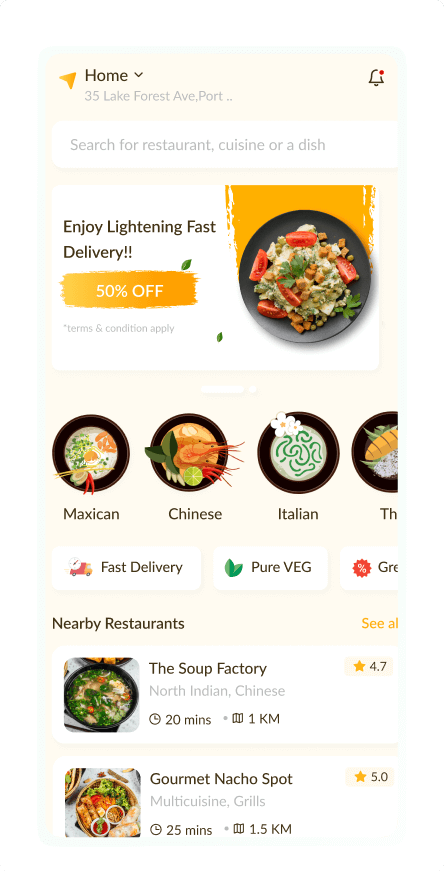
Identify the location of restaurants. (140, 623).